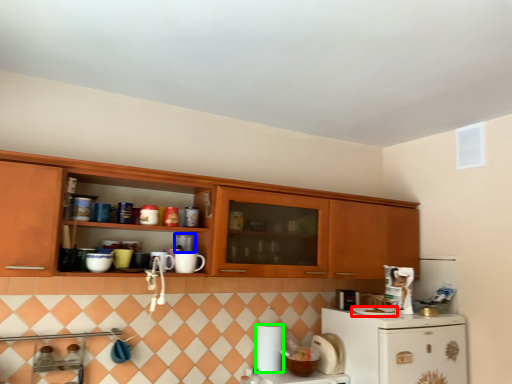
Question: Which object is positioned farthest from appliance (highlighted by a red box)? Select from appliance (highlighted by a blue box) and paper towel (highlighted by a green box).

Choices:
 (A) appliance
 (B) paper towel

Answer: (A)